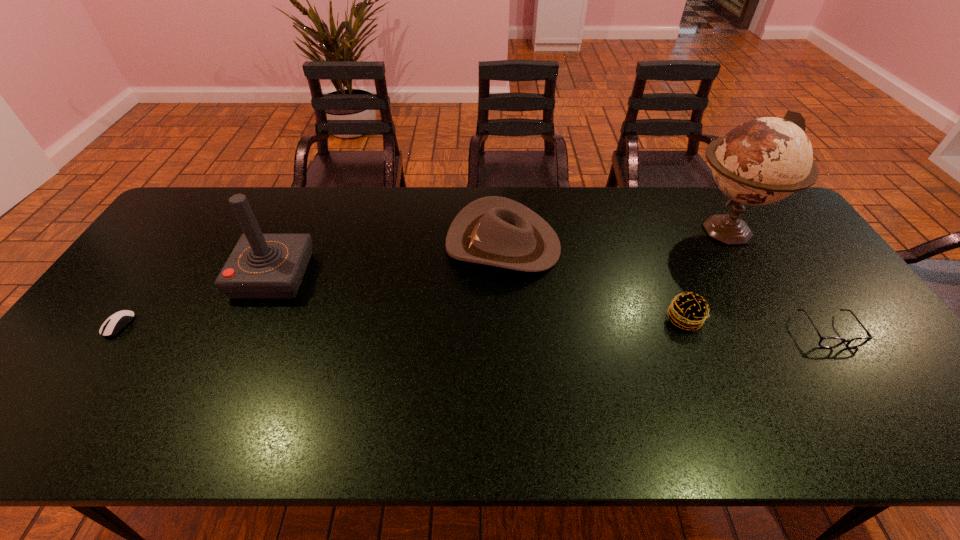
Select which object is the closest to the joystick. Please provide its 2D coordinates. Your answer should be formatted as a tuple, i.e. [(x, y)], where the tuple contains the x and y coordinates of a point satisfying the conditions above.

[(117, 321)]

Identify the location of object that can be found as the third closest to the mouse. (688, 310).

You are a GUI agent. You are given a task and a screenshot of the screen. Output one action in this format:
    pyautogui.click(x=<x>, y=<y>)
    Task: Click on the vacant position in the image that satisfies the following two spatial constraints: 1. on the front of the tallest object showing Asia; 2. on the front side of the mouse
    The width and height of the screenshot is (960, 540).
    Given the screenshot: What is the action you would take?
    coord(783,325)

Find the location of a particular element. The width and height of the screenshot is (960, 540). free location that satisfies the following two spatial constraints: 1. on the back side of the patty; 2. on the left side of the leftmost object is located at coordinates (123, 319).

This screenshot has height=540, width=960. What are the coordinates of `free spot that satisfies the following two spatial constraints: 1. on the front of the tallest object showing Asia; 2. on the front side of the shortest object` in the screenshot? It's located at (783, 325).